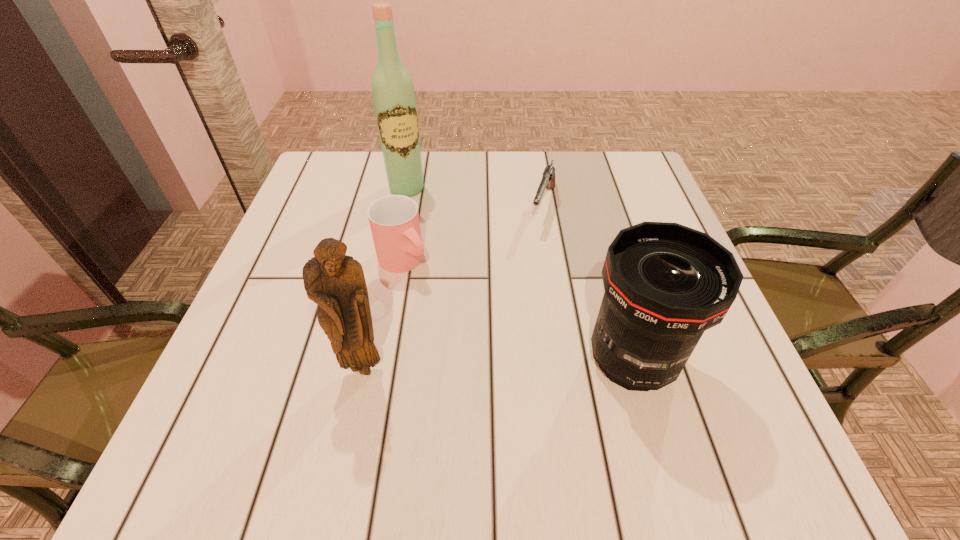
I want to click on figurine, so click(x=336, y=282).

Locate an element on the screen. Image resolution: width=960 pixels, height=540 pixels. telephoto lens is located at coordinates (665, 284).

This screenshot has height=540, width=960. I want to click on wine bottle, so click(x=393, y=92).

Find the location of `the fourth tallest object`. the fourth tallest object is located at coordinates (394, 220).

The image size is (960, 540). I want to click on the third nearest object, so [394, 220].

Identify the location of gun. (548, 179).

Where is `vacant space located on the back of the telephoto lens`? The height and width of the screenshot is (540, 960). vacant space located on the back of the telephoto lens is located at coordinates (589, 211).

The width and height of the screenshot is (960, 540). What are the coordinates of `free space located 0.240m on the front-facing side of the tallest object` in the screenshot? It's located at (438, 262).

Find the location of a particular element. vacant region located on the front-facing side of the tallest object is located at coordinates (461, 317).

What are the coordinates of `vacant point located 0.150m on the front-facing side of the tallest object` in the screenshot? It's located at (426, 236).